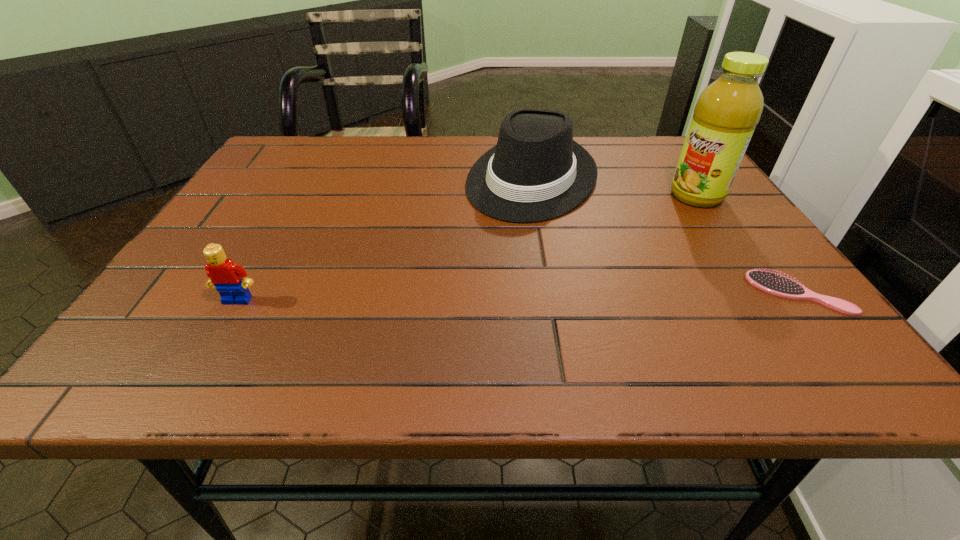
Locate an element on the screen. object located at the near right corner is located at coordinates (773, 283).

Where is `vacant space at the far edge`? The image size is (960, 540). vacant space at the far edge is located at coordinates (589, 143).

Identify the location of free space at the near edge of the desktop. (326, 301).

At what (x,y) coordinates should I click in order to perform the action: click on vacant space at the left edge of the desktop. Please return your answer as a coordinate pair (x, y). Looking at the image, I should click on (278, 178).

Where is `vacant region at the right edge of the desktop`? This screenshot has width=960, height=540. vacant region at the right edge of the desktop is located at coordinates (717, 225).

This screenshot has height=540, width=960. In order to click on vacant area at the far right corner in this screenshot , I will do `click(653, 144)`.

In order to click on unoccupied position between the second object from left to right and the hairbrush in this screenshot , I will do `click(665, 236)`.

The height and width of the screenshot is (540, 960). What are the coordinates of `vacant space that's between the second object from left to right and the leftmost object` in the screenshot? It's located at (385, 239).

Locate an element on the screen. This screenshot has height=540, width=960. vacant region between the fruit juice and the Lego is located at coordinates click(x=468, y=248).

This screenshot has width=960, height=540. Find the location of `blank region between the fruit juice and the fedora`. blank region between the fruit juice and the fedora is located at coordinates (614, 187).